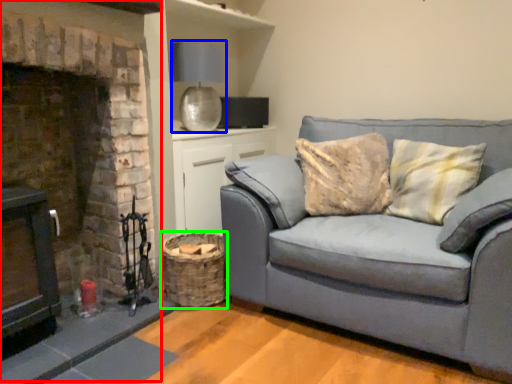
Question: Based on their relative distances, which object is nearer to fireplace (highlighted by a red box)? Choose from lamp (highlighted by a blue box) and basket (highlighted by a green box).

Choices:
 (A) lamp
 (B) basket

Answer: (B)